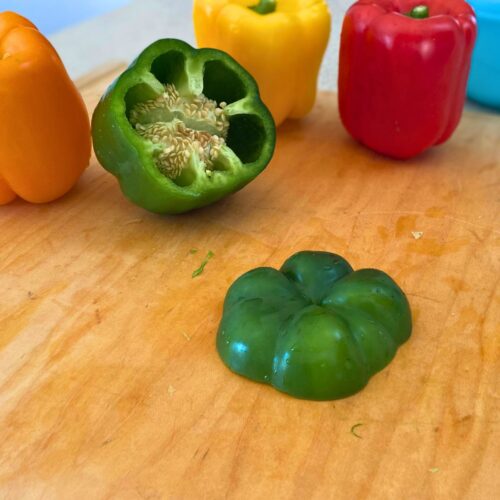
Locate an element on the screen. This screenshot has height=500, width=500. empty space on table is located at coordinates (127, 352).